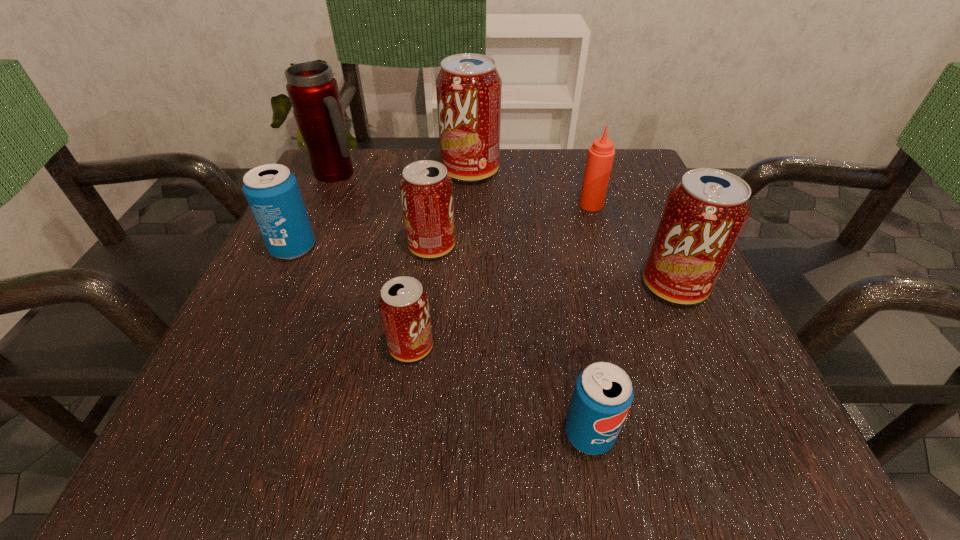
Locate an element on the screen. object situated at the far left corner is located at coordinates (313, 92).

The width and height of the screenshot is (960, 540). What are the coordinates of `object at the far right corner` in the screenshot? It's located at (601, 154).

Where is `free spot at the far edge of the desktop`? The width and height of the screenshot is (960, 540). free spot at the far edge of the desktop is located at coordinates (470, 185).

Where is `free region at the near edge of the desktop`? This screenshot has width=960, height=540. free region at the near edge of the desktop is located at coordinates (569, 454).

In the image, there is a desktop. Where is `blank space at the left edge`? The width and height of the screenshot is (960, 540). blank space at the left edge is located at coordinates (371, 216).

Locate an element on the screen. The height and width of the screenshot is (540, 960). vacant space at the right edge is located at coordinates (610, 214).

In the image, there is a desktop. Identify the location of free space at the far left corner. click(358, 200).

Locate an element on the screen. This screenshot has width=960, height=540. vacant region at the far right corner of the desktop is located at coordinates (637, 175).

This screenshot has height=540, width=960. What are the coordinates of `free region at the near right corner` in the screenshot? It's located at (694, 458).

Where is `free space between the second object from right to left and the second nearest object`? free space between the second object from right to left and the second nearest object is located at coordinates (501, 275).